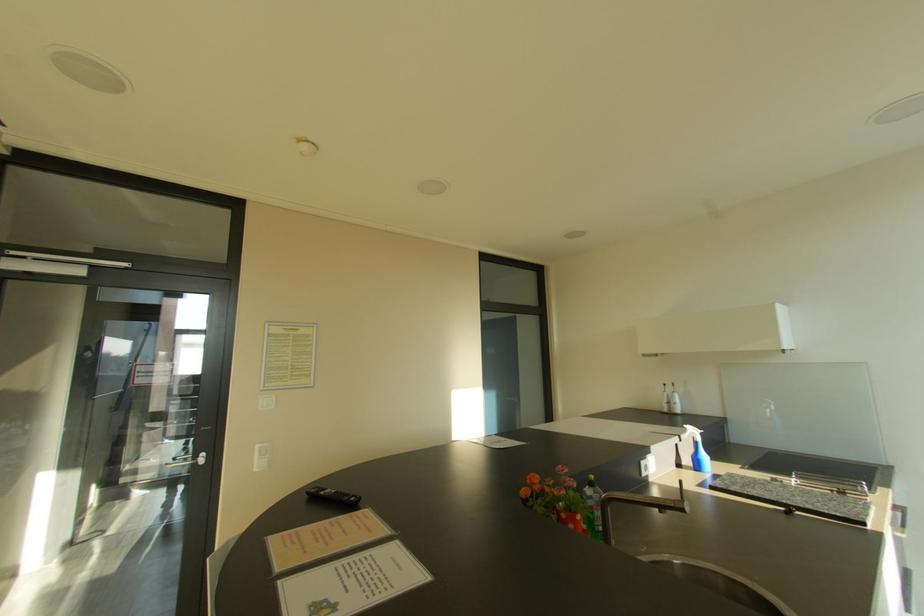
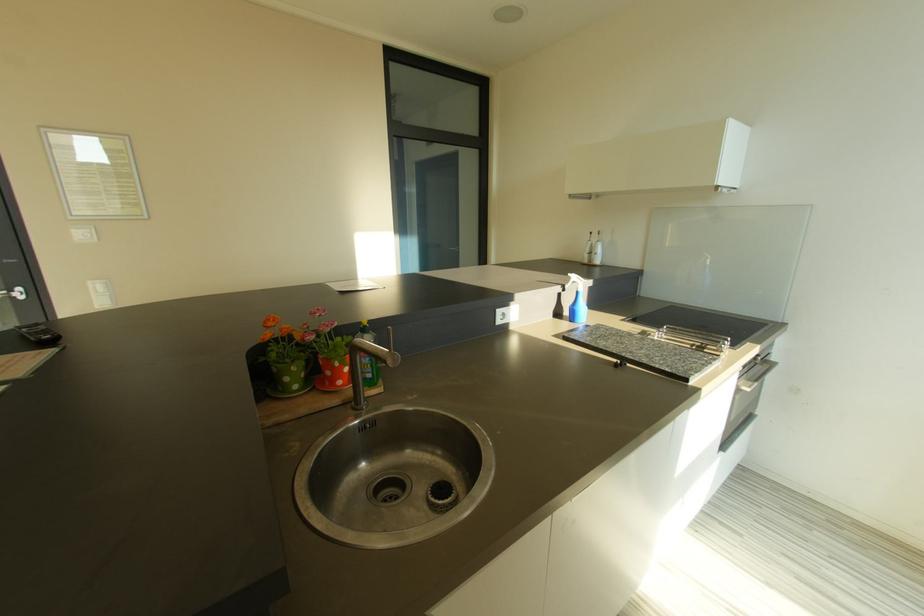
Question: Based on the continuous images, in which direction is the camera rotating? Reply with the corresponding letter.

Choices:
 (A) Left
 (B) Right
 (C) Up
 (D) Down

Answer: (D)